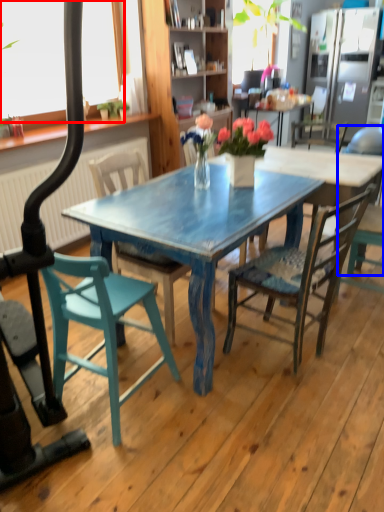
Question: Among these objects, which one is nearest to the camera, window screen (highlighted by a red box) or chair (highlighted by a blue box)?

Choices:
 (A) window screen
 (B) chair

Answer: (B)